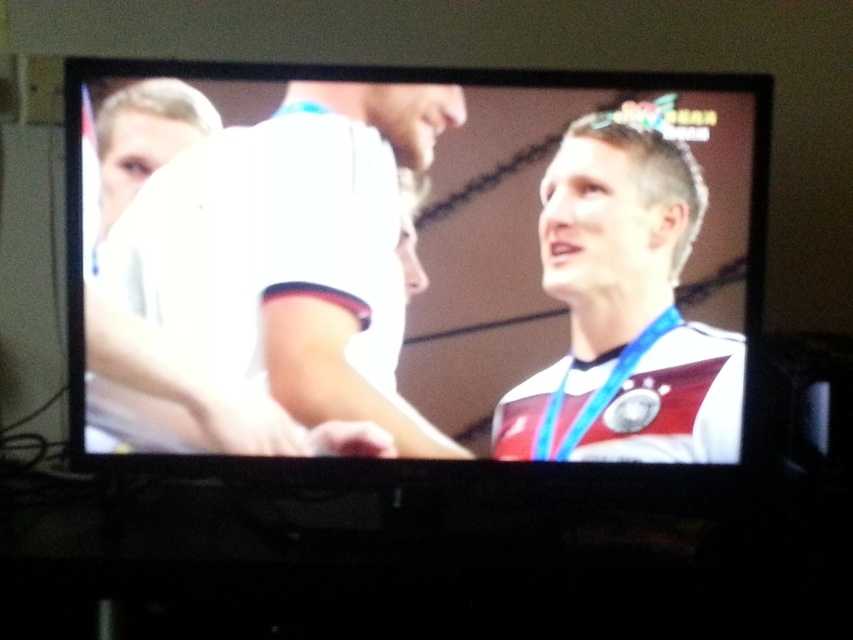
You are watching a sports event on the TV and see two people celebrating. The white fabric shirt at right and the white matte shirt at upper left are visible. Which one appears taller in the image?

The white fabric shirt at right appears taller than the white matte shirt at upper left in the image.

Based on the scene described, can you determine if the white fabric shirt at right has a greater width compared to the white matte shirt at upper left?

The white fabric shirt at right is wider than the white matte shirt at upper left according to the description provided.

You are watching a sports event on the TV and notice two white clothing items. The white jersey at center and the white fabric shirt at upper left. Which one is closer to you?

The white jersey at center is closer to the viewer than the white fabric shirt at upper left.